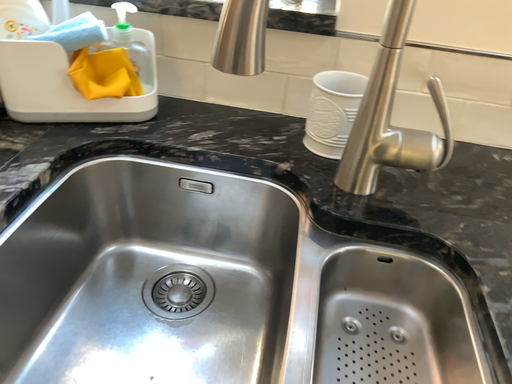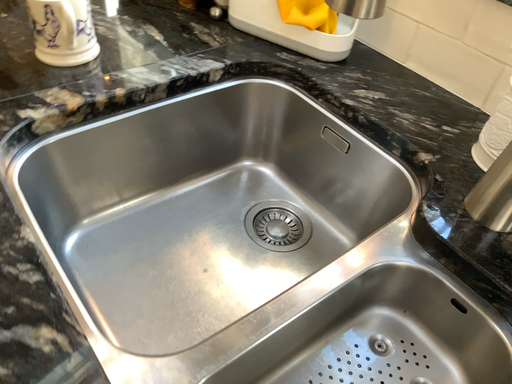
Question: How did the camera likely rotate when shooting the video?

Choices:
 (A) rotated left
 (B) rotated right

Answer: (A)